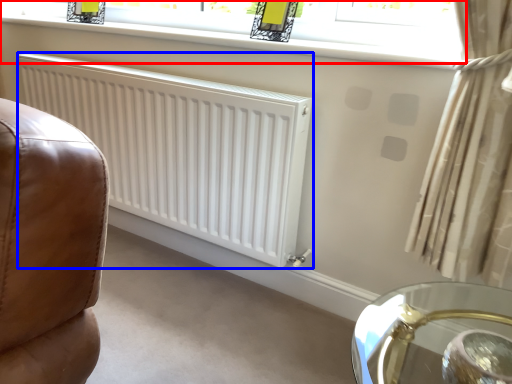
Question: Which point is closer to the camera, window (highlighted by a red box) or radiator (highlighted by a blue box)?

Choices:
 (A) window
 (B) radiator

Answer: (A)